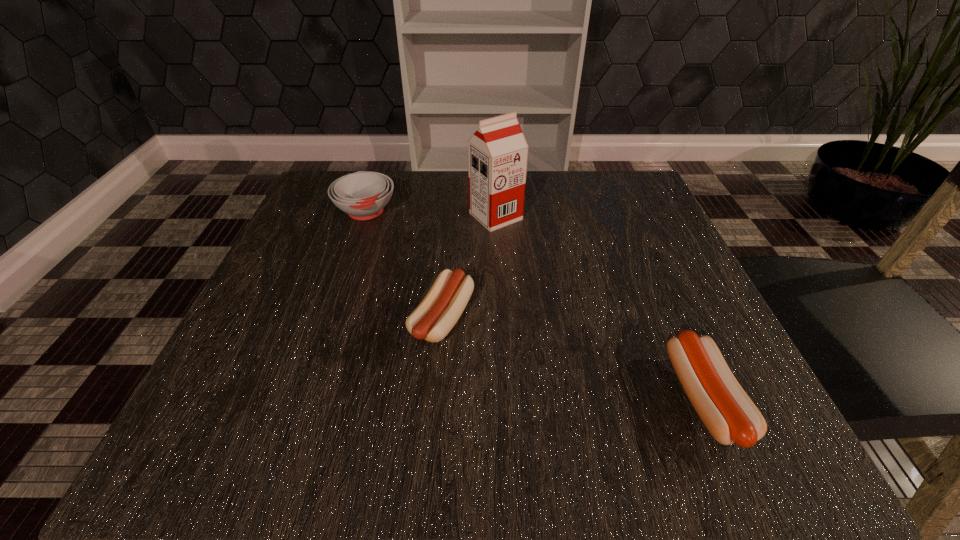
Find the location of a particular element. The height and width of the screenshot is (540, 960). empty location between the right sausage and the leftmost object is located at coordinates (x=535, y=305).

The height and width of the screenshot is (540, 960). Identify the location of free area in between the right sausage and the leftmost object. (535, 305).

You are a GUI agent. You are given a task and a screenshot of the screen. Output one action in this format:
    pyautogui.click(x=<x>, y=<y>)
    Task: Click on the vacant region between the leftmost object and the left sausage
    
    Given the screenshot: What is the action you would take?
    pyautogui.click(x=404, y=266)

Where is `the third closest object to the left sausage`? The image size is (960, 540). the third closest object to the left sausage is located at coordinates (728, 413).

Locate an element on the screen. The height and width of the screenshot is (540, 960). object that is the nearest to the left sausage is located at coordinates (497, 152).

Find the location of a particular element. This screenshot has width=960, height=540. free space that satisfies the following two spatial constraints: 1. on the back side of the tallest object; 2. on the right side of the left sausage is located at coordinates (451, 217).

Locate an element on the screen. vacant space that satisfies the following two spatial constraints: 1. on the front side of the leftmost object; 2. on the right side of the right sausage is located at coordinates (301, 398).

Where is `vacant region that satisfies the following two spatial constraints: 1. on the front side of the left sausage; 2. on the left side of the right sausage`? vacant region that satisfies the following two spatial constraints: 1. on the front side of the left sausage; 2. on the left side of the right sausage is located at coordinates (436, 398).

At what (x,y) coordinates should I click in order to perform the action: click on vacant point that satisfies the following two spatial constraints: 1. on the back side of the soya milk; 2. on the left side of the left sausage. Please return your answer as a coordinate pair (x, y). This screenshot has height=540, width=960. Looking at the image, I should click on (451, 217).